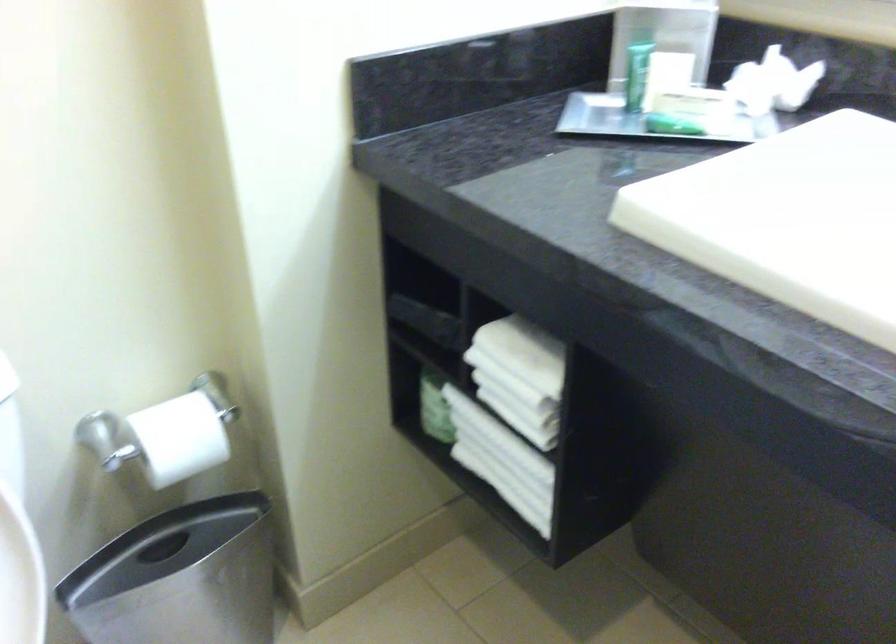
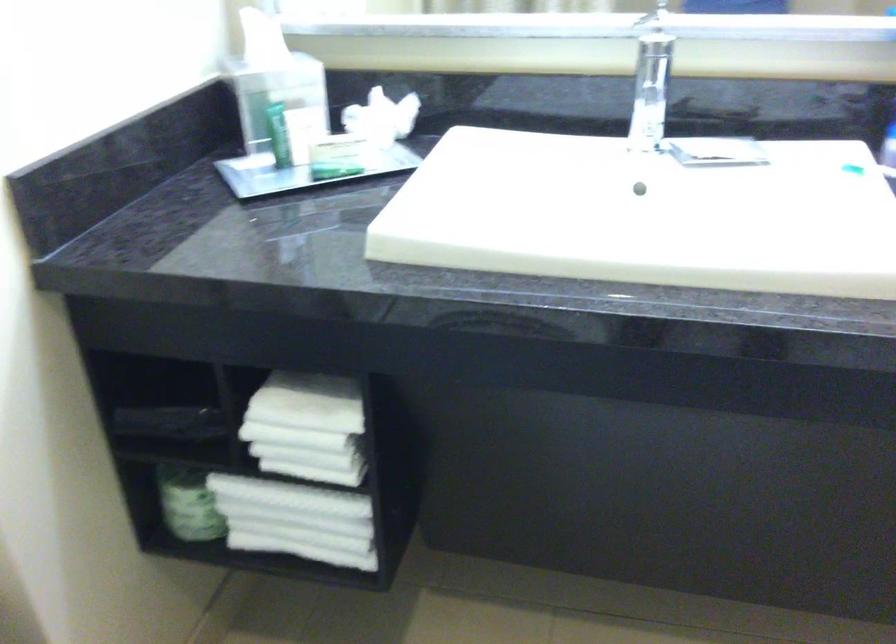
Locate, in the second image, the point that corresponds to [500,459] in the first image.

(296, 520)